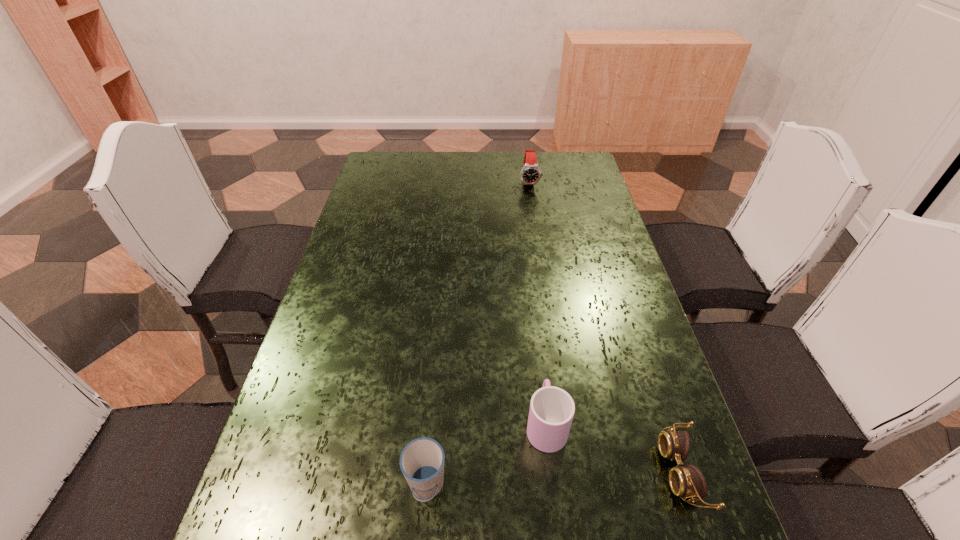
I want to click on object that is the closest to the watch, so click(x=552, y=409).

You are a GUI agent. You are given a task and a screenshot of the screen. Output one action in this format:
    pyautogui.click(x=<x>, y=<y>)
    Task: Click on the vacant region that satisfies the following two spatial constraints: 1. through the lenses of the rightmost object; 2. with a handle on the side of the left cup
    
    Given the screenshot: What is the action you would take?
    pyautogui.click(x=687, y=487)

Locate an element on the screen. The image size is (960, 540). vacant area in the image that satisfies the following two spatial constraints: 1. through the lenses of the shortest object; 2. with a handle on the side of the left cup is located at coordinates pyautogui.click(x=687, y=487).

Identify the location of free space that satisfies the following two spatial constraints: 1. through the lenses of the shortest object; 2. with a handle on the side of the nearer cup. 687,487.